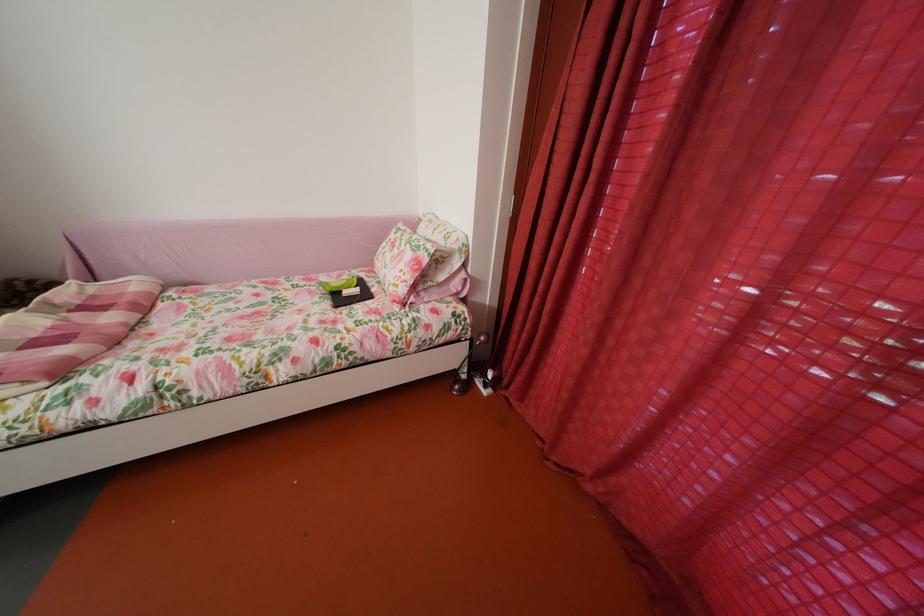
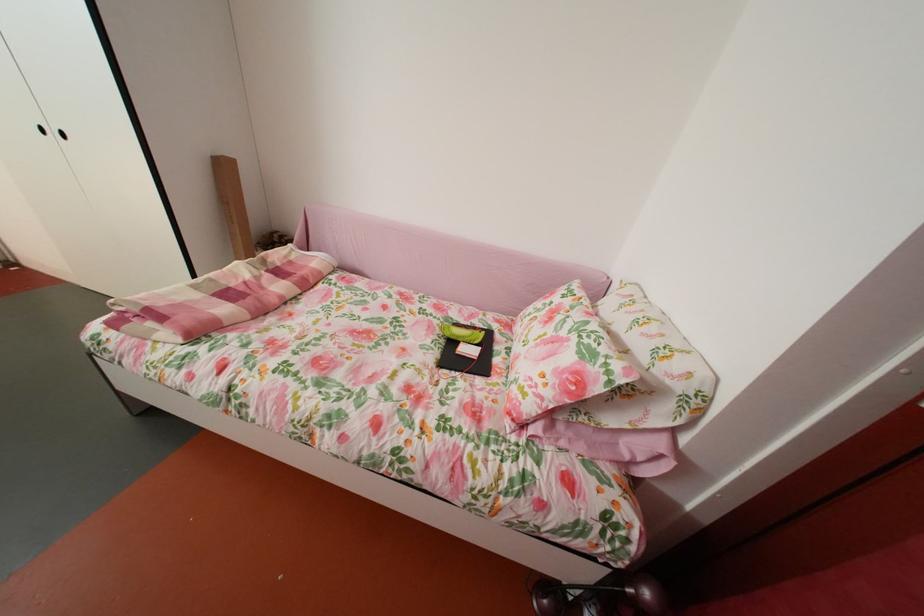
The point at (414, 296) is marked in the first image. Where is the corresponding point in the second image?

(541, 413)